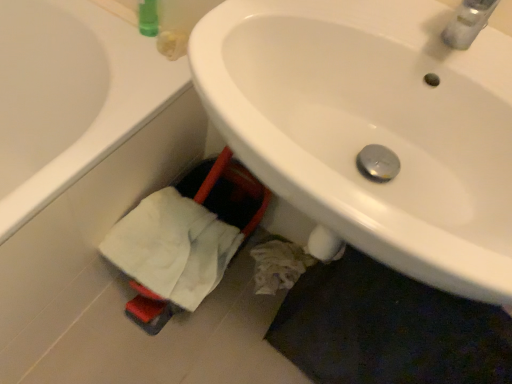
Question: From the image's perspective, relative to white matte bathtub at lower left, is white cotton bath towel at lower left above or below?

Choices:
 (A) below
 (B) above

Answer: (A)

Question: Is white cotton bath towel at lower left inside or outside of white matte bathtub at lower left?

Choices:
 (A) inside
 (B) outside

Answer: (B)

Question: Considering the real-world distances, which object is closest to the white glossy sink at center?

Choices:
 (A) white cotton bath towel at lower left
 (B) white matte bathtub at lower left

Answer: (A)

Question: Based on their relative distances, which object is farther from the white matte bathtub at lower left?

Choices:
 (A) white cotton bath towel at lower left
 (B) white glossy sink at center

Answer: (B)